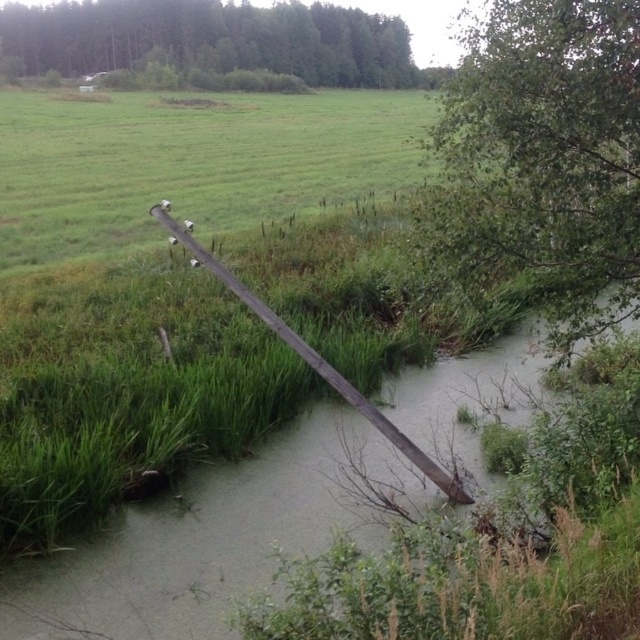
Question: Is the position of green leafy tree at upper center more distant than that of wooden pole at center?

Choices:
 (A) yes
 (B) no

Answer: (A)

Question: From the image, what is the correct spatial relationship of green leafy tree at lower right in relation to green leafy tree at upper center?

Choices:
 (A) left
 (B) right

Answer: (B)

Question: Which of the following is the farthest from the observer?

Choices:
 (A) (342, 381)
 (B) (189, 61)
 (C) (564, 19)

Answer: (B)

Question: Based on their relative distances, which object is nearer to the green leafy tree at lower right?

Choices:
 (A) wooden pole at center
 (B) green leafy tree at upper center

Answer: (A)

Question: Where is green leafy tree at upper center located in relation to wooden pole at center in the image?

Choices:
 (A) left
 (B) right

Answer: (A)

Question: Which object appears closest to the camera in this image?

Choices:
 (A) green leafy tree at upper center
 (B) green leafy tree at lower right
 (C) wooden pole at center

Answer: (C)